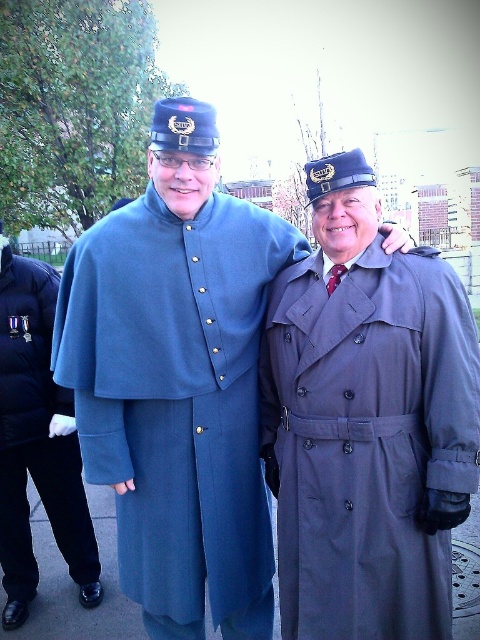
Question: Which object is farther from the camera taking this photo?

Choices:
 (A) blue wool cape at center
 (B) gray matte trench coat at right

Answer: (A)

Question: Does gray matte trench coat at right appear under blue wool cape at center?

Choices:
 (A) yes
 (B) no

Answer: (B)

Question: Is gray matte trench coat at right behind blue wool cape at center?

Choices:
 (A) no
 (B) yes

Answer: (A)

Question: Is gray matte trench coat at right positioned at the back of blue wool cape at center?

Choices:
 (A) yes
 (B) no

Answer: (B)

Question: Among these objects, which one is farthest from the camera?

Choices:
 (A) blue wool cape at center
 (B) gray matte trench coat at right

Answer: (A)